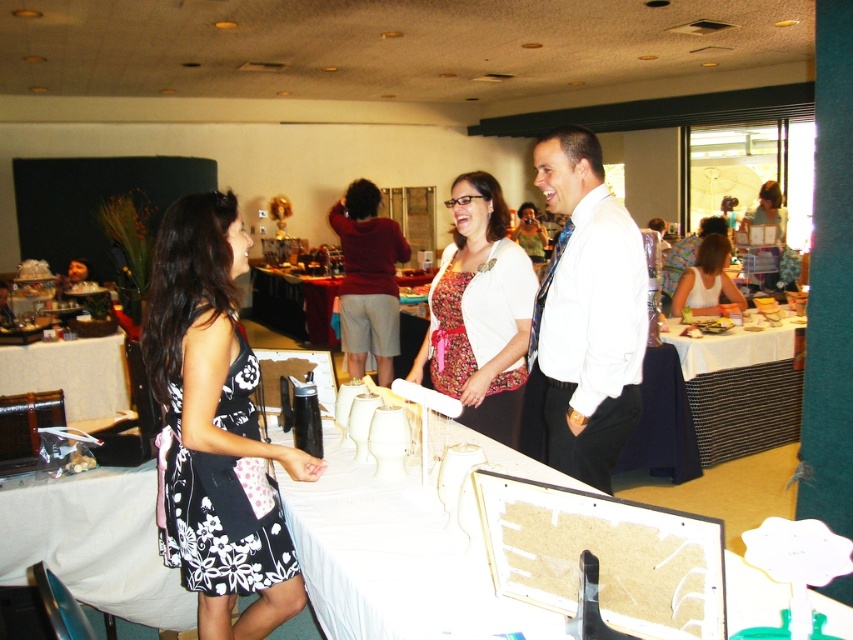
You are standing at the entrance of the room and see two points marked in the image. Which point is closer to you, point [582,432] or point [712,240]?

Point [582,432] is in front of point [712,240], so it is closer to you.

Looking at this image, you are a photographer at the event and want to capture a photo of both the floral fabric dress at center and the white fabric table at center. Since you want to include both in the frame, which object should you position closer to the camera to ensure both are fully visible?

The floral fabric dress at center is taller than the white fabric table at center. To include both in the frame, position the floral fabric dress at center closer to the camera so its height doesn